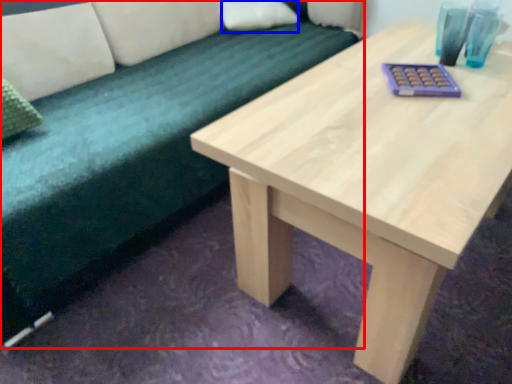
Question: Which object appears closest to the camera in this image, studio couch (highlighted by a red box) or pillow (highlighted by a blue box)?

Choices:
 (A) studio couch
 (B) pillow

Answer: (A)